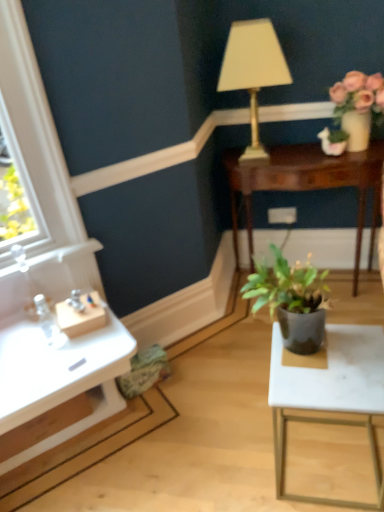
Identify the location of vacant space underneath white marble table at lower right, positioned as the second table in back-to-front order (from a real-world perspective). This screenshot has height=512, width=384. (325, 464).